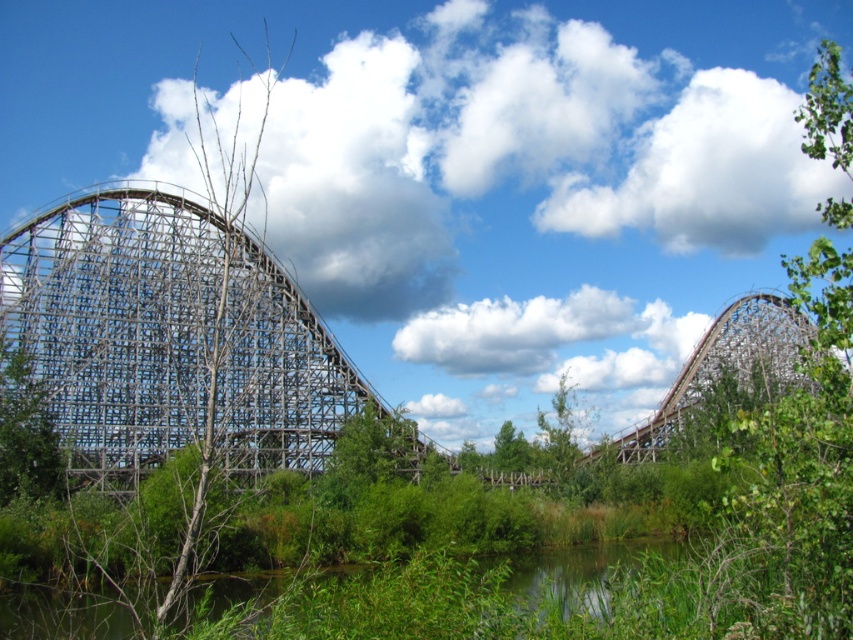
Between green grassy river at lower center and green wood tree at left, which one appears on the left side from the viewer's perspective?

green wood tree at left is more to the left.

How far apart are green grassy river at lower center and green wood tree at left?

green grassy river at lower center and green wood tree at left are 23.91 meters apart from each other.

The width and height of the screenshot is (853, 640). Identify the location of green grassy river at lower center. (583, 572).

Where is `green grassy river at lower center`? The image size is (853, 640). green grassy river at lower center is located at coordinates (583, 572).

Can you confirm if green wood tree at left is positioned below green leafy tree at center?

No, green wood tree at left is not below green leafy tree at center.

Who is more distant from viewer, (32,404) or (364,440)?

Positioned behind is point (364,440).

Based on the photo, measure the distance between green wood tree at left and camera.

They are 99.96 meters apart.

Image resolution: width=853 pixels, height=640 pixels. I want to click on green wood tree at left, so click(x=25, y=435).

Who is shorter, green grassy river at lower center or green leafy tree at center?

green grassy river at lower center is shorter.

What do you see at coordinates (583, 572) in the screenshot? This screenshot has width=853, height=640. I see `green grassy river at lower center` at bounding box center [583, 572].

This screenshot has width=853, height=640. What are the coordinates of `green grassy river at lower center` in the screenshot? It's located at (583, 572).